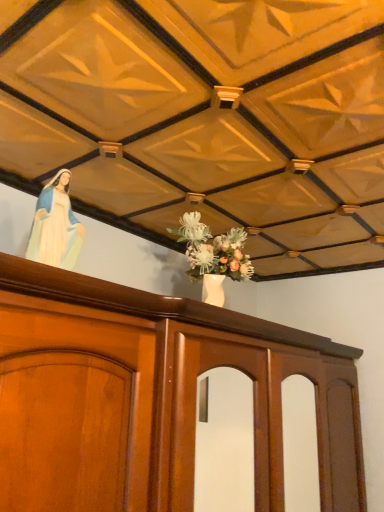
Question: From the image's perspective, relative to wooden cabinet at center, is smooth porcelain statue at upper left above or below?

Choices:
 (A) above
 (B) below

Answer: (A)

Question: Is smooth porcelain statue at upper left in front of or behind wooden cabinet at center in the image?

Choices:
 (A) front
 (B) behind

Answer: (B)

Question: From a real-world perspective, is smooth porcelain statue at upper left physically located above or below wooden cabinet at center?

Choices:
 (A) above
 (B) below

Answer: (A)

Question: From the image's perspective, is wooden cabinet at center located above or below smooth porcelain statue at upper left?

Choices:
 (A) above
 (B) below

Answer: (B)

Question: From a real-world perspective, is wooden cabinet at center positioned above or below smooth porcelain statue at upper left?

Choices:
 (A) below
 (B) above

Answer: (A)

Question: Based on their positions, is wooden cabinet at center located to the left or right of smooth porcelain statue at upper left?

Choices:
 (A) right
 (B) left

Answer: (A)

Question: In terms of width, does wooden cabinet at center look wider or thinner when compared to smooth porcelain statue at upper left?

Choices:
 (A) wide
 (B) thin

Answer: (A)